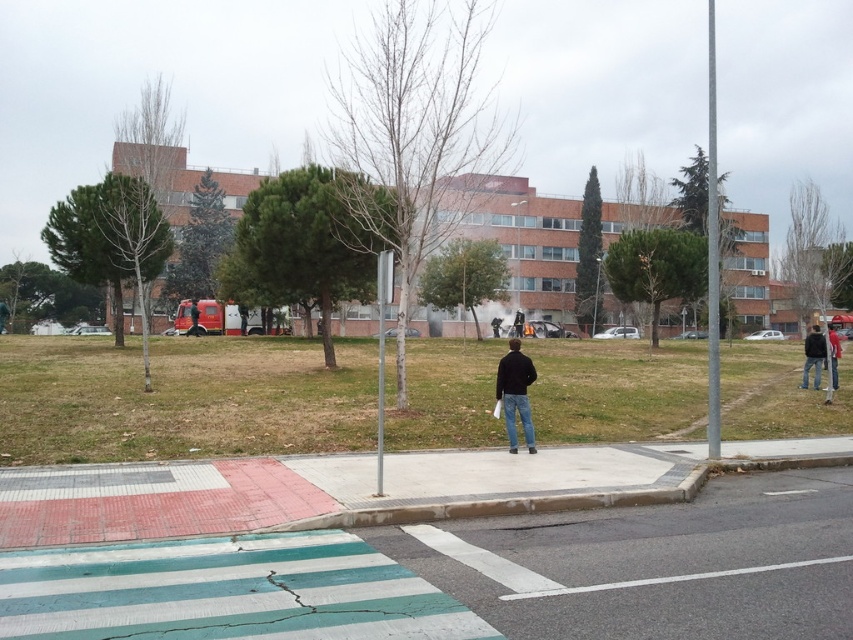
Can you confirm if dark blue jeans at right is smaller than dark blue jeans at lower right?

Yes.

You are a GUI agent. You are given a task and a screenshot of the screen. Output one action in this format:
    pyautogui.click(x=<x>, y=<y>)
    Task: Click on the dark blue jeans at right
    The width and height of the screenshot is (853, 640).
    Given the screenshot: What is the action you would take?
    pyautogui.click(x=813, y=356)

Image resolution: width=853 pixels, height=640 pixels. Find the location of `dark blue jeans at right`. dark blue jeans at right is located at coordinates (813, 356).

How distant is dark blue jeans at center from dark blue jeans at lower right?

14.65 meters

Does dark blue jeans at center appear on the right side of dark blue jeans at lower right?

Incorrect, dark blue jeans at center is not on the right side of dark blue jeans at lower right.

Is point (500, 374) positioned before point (831, 381)?

Yes, it is.

Identify the location of dark blue jeans at center. The height and width of the screenshot is (640, 853). (515, 394).

How distant is dark blue jeans at center from dark blue jeans at right?

They are 10.91 meters apart.

Which is more to the left, dark blue jeans at center or dark blue jeans at right?

dark blue jeans at center

Is point (508, 433) closer to camera compared to point (813, 348)?

Yes, it is.

Locate an element on the screen. dark blue jeans at center is located at coordinates (515, 394).